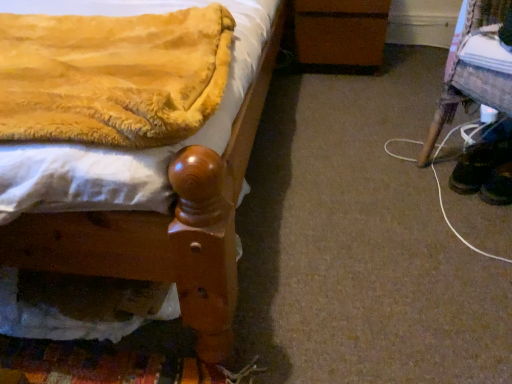
The height and width of the screenshot is (384, 512). In order to click on free region on the left part of black leather shoes at lower right, which ranks as the first footwear in left-to-right order in this screenshot , I will do `click(411, 176)`.